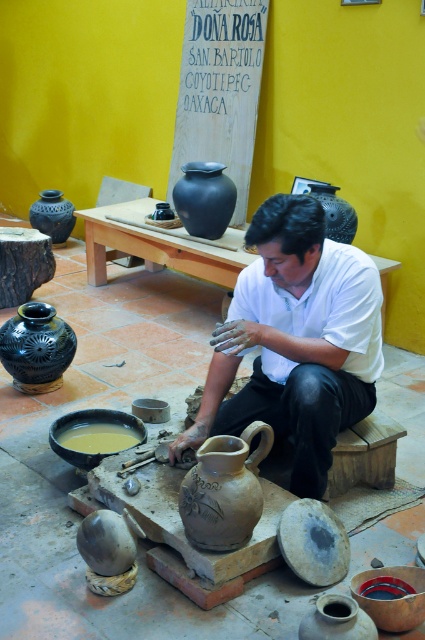
You are an apprentice potter in the workshop and need to place a new clay piece between the black matte vase at left and the matte black vase at left. However, you notice something odd about their arrangement. What is the problem with their current positioning?

The black matte vase at left is positioned on the right side of matte black vase at left, which means both vases are placed in the same location since they are identical in description. This creates confusion and makes it impossible to place a new clay piece between them as they occupy the same spot.

You are a pottery student who wants to place a new clay pot between the black matte vase at left and the matte black vase at left on the stone slab. Which vase should you place the pot closer to if you want the pot to be centered between them?

You should place the pot closer to the matte black vase at left because the black matte vase at left is wider, so centering the pot between them requires adjusting for the width difference.

In the scene shown: You are a photographer trying to capture the pottery workshop scene. You notice the matte white shirt at center and the matte black vase at center. Which object should you focus on if you want to highlight the larger object in your photo?

The matte white shirt at center is larger in size than the matte black vase at center, so you should focus on the matte white shirt at center to highlight the larger object in your photo.